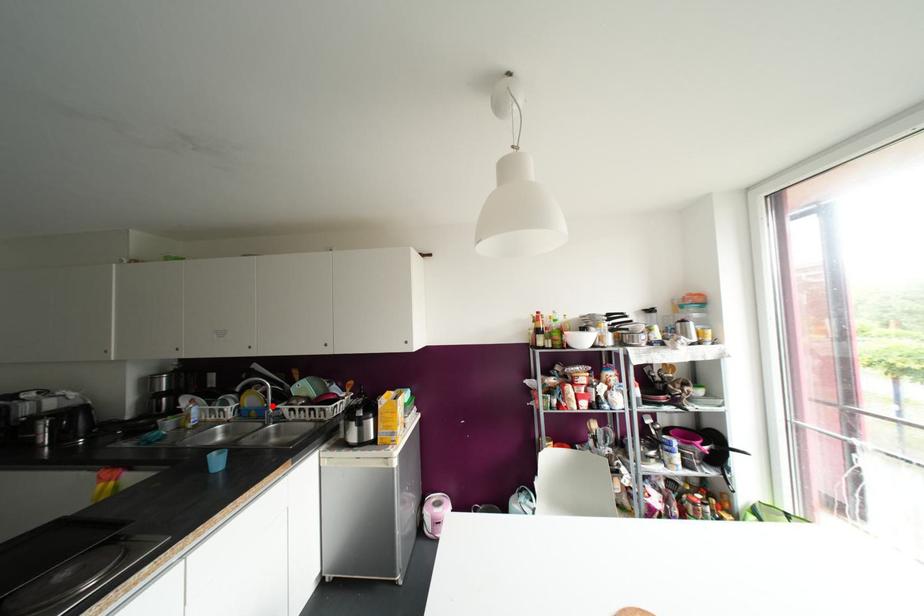
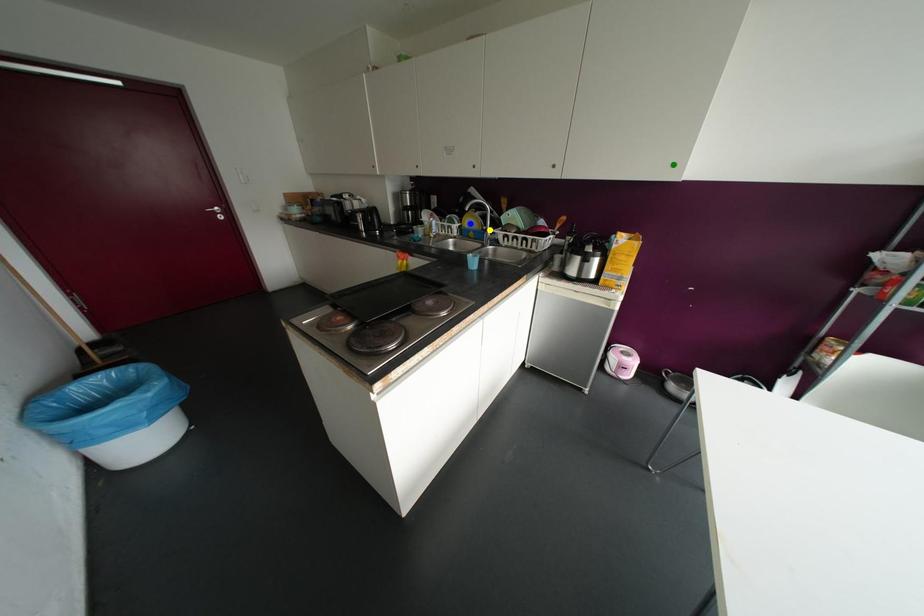
Question: I am providing you with two images of the same scene from different viewpoints. A red point is marked on the first image. You are given multiple points on the second image. Which point in image 2 is actually the same real-world point as the red point in image 1?

Choices:
 (A) yellow point
 (B) blue point
 (C) green point

Answer: (A)